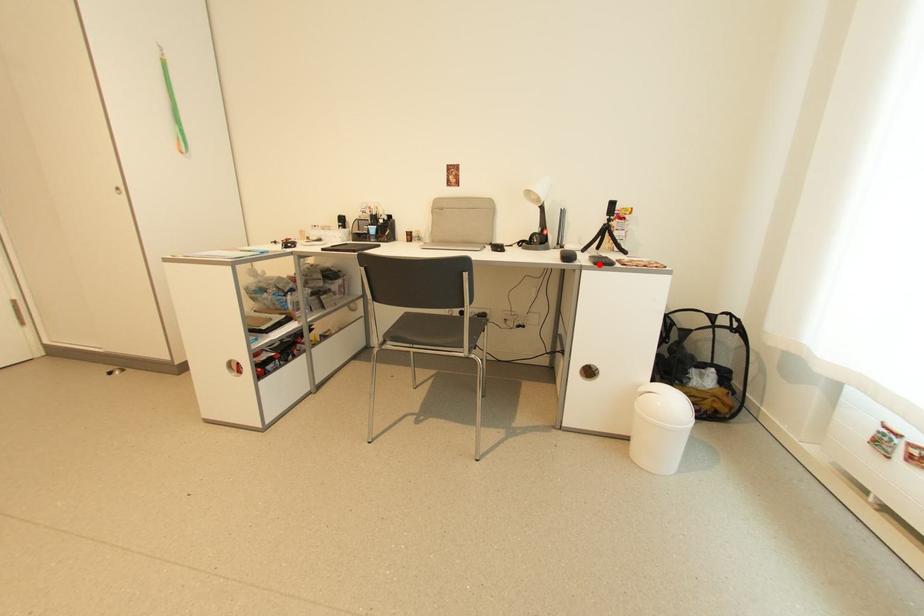
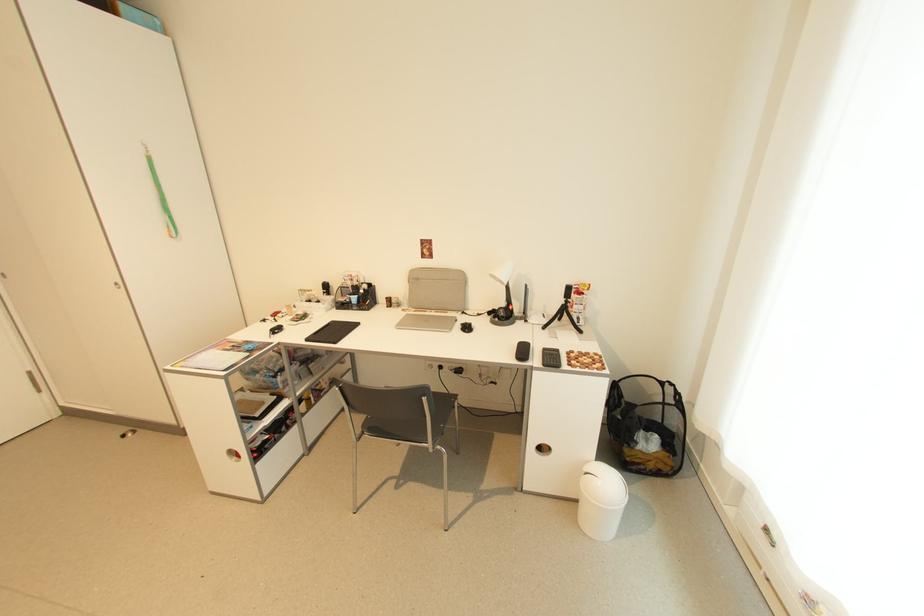
Locate, in the second image, the point that corresponds to the highlighted location in the first image.

(548, 367)